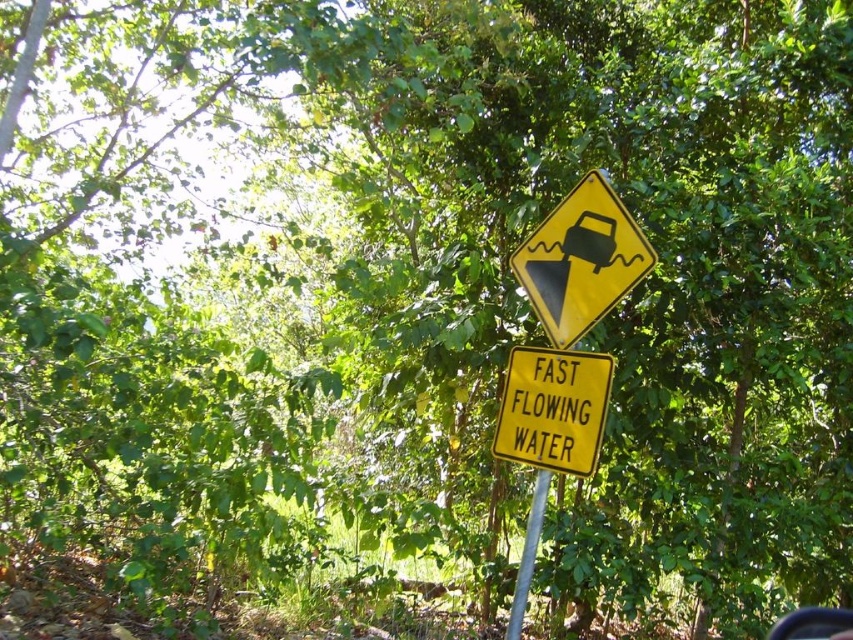
Who is positioned more to the left, yellow/yellowish metal sign at center or metallic silver pole at center?

Positioned to the left is metallic silver pole at center.

Which is more to the right, yellow/yellowish metal sign at center or metallic silver pole at center?

yellow/yellowish metal sign at center

Which is behind, point (515, 451) or point (508, 624)?

The point (508, 624) is more distant.

I want to click on yellow/yellowish metal sign at center, so click(x=553, y=408).

Between yellow plastic sign at center and metallic silver pole at center, which one appears on the right side from the viewer's perspective?

yellow plastic sign at center

Consider the image. Is yellow plastic sign at center shorter than metallic silver pole at center?

Yes.

Locate an element on the screen. The image size is (853, 640). yellow plastic sign at center is located at coordinates (581, 259).

Find the location of `yellow plastic sign at center`. yellow plastic sign at center is located at coordinates (581, 259).

Can you confirm if yellow plastic sign at center is thinner than transparent glass car window at center?

In fact, yellow plastic sign at center might be wider than transparent glass car window at center.

Consider the image. Can you confirm if yellow plastic sign at center is positioned below transparent glass car window at center?

No, yellow plastic sign at center is not below transparent glass car window at center.

Is point (563, 285) in front of point (816, 616)?

That is True.

Where is `yellow plastic sign at center`? The width and height of the screenshot is (853, 640). yellow plastic sign at center is located at coordinates (581, 259).